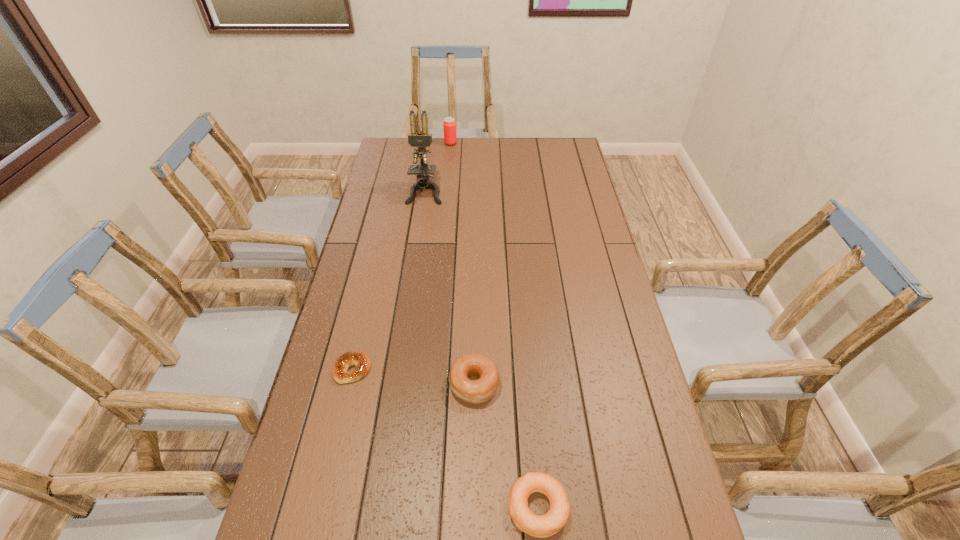
This screenshot has width=960, height=540. In order to click on free space that satisfies the following two spatial constraints: 1. on the back side of the leftmost bagel; 2. on the left side of the farthest object in this screenshot , I will do `click(405, 144)`.

In order to click on vacant space that satisfies the following two spatial constraints: 1. on the front side of the fourth shortest object; 2. on the right side of the second object from right to left in this screenshot , I will do `click(429, 384)`.

Where is `free point that satisfies the following two spatial constraints: 1. on the back side of the beer can; 2. on the right side of the shortest bagel`? free point that satisfies the following two spatial constraints: 1. on the back side of the beer can; 2. on the right side of the shortest bagel is located at coordinates [405, 144].